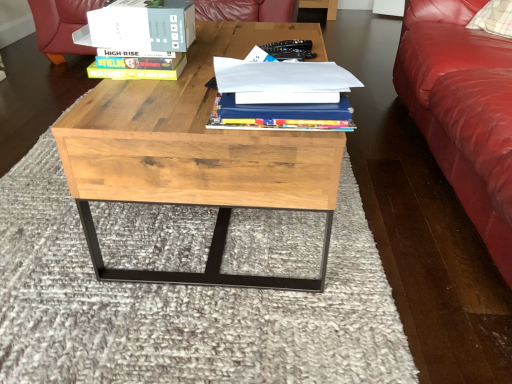
Question: Choose the correct answer: Is natural wood coffee table at center inside white cardboard box at upper center or outside it?

Choices:
 (A) outside
 (B) inside

Answer: (A)

Question: Considering the positions of natural wood coffee table at center and white cardboard box at upper center in the image, is natural wood coffee table at center taller or shorter than white cardboard box at upper center?

Choices:
 (A) tall
 (B) short

Answer: (A)

Question: Estimate the real-world distances between objects in this image. Which object is farther from the natural wood coffee table at center?

Choices:
 (A) hardcover book at upper left
 (B) white cardboard box at upper center
 (C) blue hardcover book at center

Answer: (A)

Question: Which is farther from the white cardboard box at upper center?

Choices:
 (A) natural wood coffee table at center
 (B) blue hardcover book at center
 (C) hardcover book at upper left

Answer: (A)